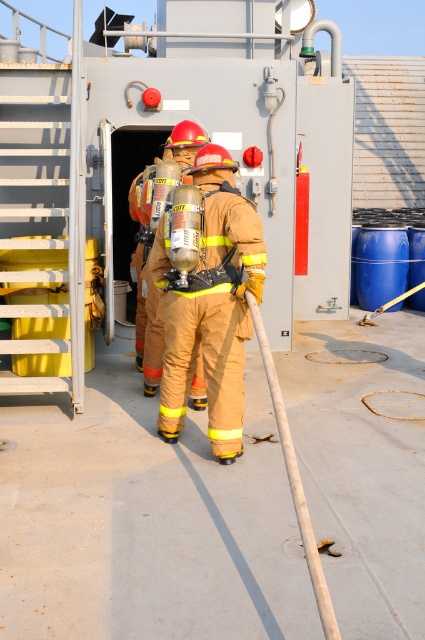
Question: Among these points, which one is nearest to the camera?

Choices:
 (A) (209, 308)
 (B) (155, 358)

Answer: (A)

Question: Does brown/cotton fireman at center have a larger size compared to matte yellow fireman at center?

Choices:
 (A) no
 (B) yes

Answer: (B)

Question: Can you confirm if brown/cotton fireman at center is wider than matte yellow fireman at center?

Choices:
 (A) yes
 (B) no

Answer: (A)

Question: Does brown/cotton fireman at center have a smaller size compared to matte yellow fireman at center?

Choices:
 (A) yes
 (B) no

Answer: (B)